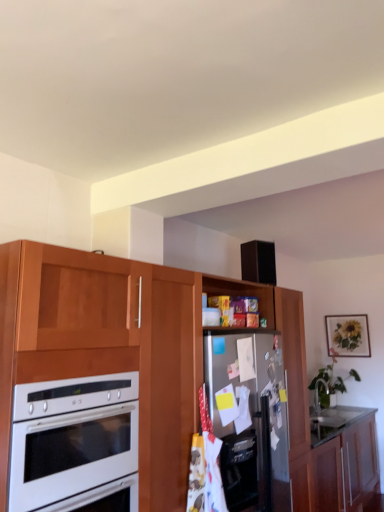
Question: In terms of size, does matte wooden picture frame at upper right appear bigger or smaller than wooden cabinet at lower right, which ranks as the first cabinetry in bottom-to-top order?

Choices:
 (A) big
 (B) small

Answer: (B)

Question: In the image, is matte wooden picture frame at upper right positioned in front of or behind wooden cabinet at lower right, which ranks as the first cabinetry in bottom-to-top order?

Choices:
 (A) behind
 (B) front

Answer: (A)

Question: Which is nearer to the wooden cabinet at lower right, the second cabinetry positioned from the top?

Choices:
 (A) stainless steel fridge at center
 (B) white glossy oven at left
 (C) matte wooden picture frame at upper right
 (D) wooden cabinet at center, the 2th cabinetry ordered from the bottom

Answer: (D)

Question: Based on their relative distances, which object is nearer to the stainless steel fridge at center?

Choices:
 (A) matte wooden picture frame at upper right
 (B) white glossy oven at left
 (C) wooden cabinet at center, the 2th cabinetry ordered from the bottom
 (D) wooden cabinet at lower right, which ranks as the first cabinetry in bottom-to-top order

Answer: (C)